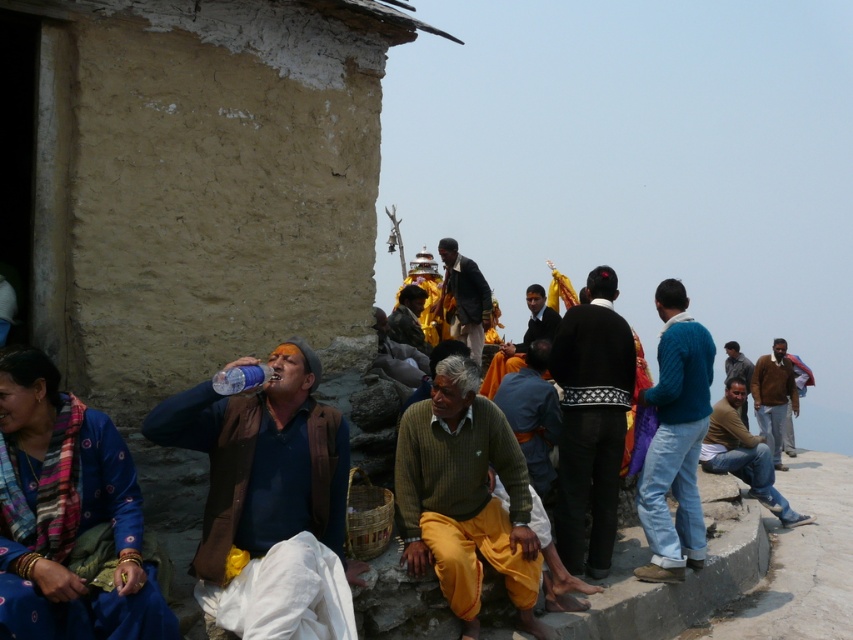
Can you confirm if black wool sweater at center is wider than transparent plastic bottle at center?

Yes, black wool sweater at center is wider than transparent plastic bottle at center.

Based on the photo, does black wool sweater at center have a smaller size compared to transparent plastic bottle at center?

No.

Where is `black wool sweater at center`? This screenshot has height=640, width=853. black wool sweater at center is located at coordinates (590, 420).

In the scene shown: Does black wool sweater at center have a smaller size compared to orange fabric cloth at center?

Correct, black wool sweater at center occupies less space than orange fabric cloth at center.

Does black wool sweater at center have a greater height compared to orange fabric cloth at center?

No.

Who is more forward, (569,324) or (531,308)?

Positioned in front is point (569,324).

Where is `black wool sweater at center`? Image resolution: width=853 pixels, height=640 pixels. black wool sweater at center is located at coordinates (590, 420).

Is black wool sweater at center thinner than blue knitted sweater at right?

Incorrect, black wool sweater at center's width is not less than blue knitted sweater at right's.

Between point (612, 404) and point (686, 376), which one is positioned in front?

Point (612, 404)

Is point (579, 545) farther from camera compared to point (701, 397)?

No, it is not.

Image resolution: width=853 pixels, height=640 pixels. I want to click on black wool sweater at center, so click(x=590, y=420).